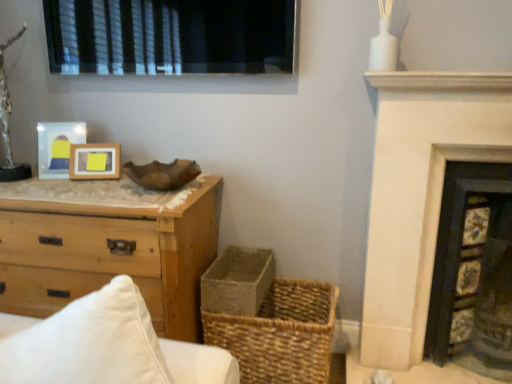
Question: Is wooden frame at center, the second picture frame viewed from the left, inside dark gray stone fireplace at right, marked as the 2th fireplace in a left-to-right arrangement?

Choices:
 (A) yes
 (B) no

Answer: (B)

Question: Could you tell me if dark gray stone fireplace at right, marked as the 2th fireplace in a left-to-right arrangement, is facing wooden frame at center, the second picture frame viewed from the left?

Choices:
 (A) yes
 (B) no

Answer: (B)

Question: Is dark gray stone fireplace at right, positioned as the first fireplace in right-to-left order, touching wooden frame at center, the second picture frame viewed from the left?

Choices:
 (A) no
 (B) yes

Answer: (A)

Question: Considering the relative sizes of dark gray stone fireplace at right, marked as the 2th fireplace in a left-to-right arrangement, and wooden frame at center, which appears as the first picture frame when viewed from the right, in the image provided, is dark gray stone fireplace at right, marked as the 2th fireplace in a left-to-right arrangement, bigger than wooden frame at center, which appears as the first picture frame when viewed from the right,?

Choices:
 (A) yes
 (B) no

Answer: (A)

Question: Is dark gray stone fireplace at right, positioned as the first fireplace in right-to-left order, at the right side of wooden frame at center, the second picture frame viewed from the left?

Choices:
 (A) no
 (B) yes

Answer: (B)

Question: From the image's perspective, is dark gray stone fireplace at right, marked as the 2th fireplace in a left-to-right arrangement, beneath wooden frame at center, the second picture frame viewed from the left?

Choices:
 (A) no
 (B) yes

Answer: (B)

Question: Considering the relative sizes of dark gray stone fireplace at right, positioned as the first fireplace in right-to-left order, and natural wood chest of drawers at left in the image provided, is dark gray stone fireplace at right, positioned as the first fireplace in right-to-left order, bigger than natural wood chest of drawers at left?

Choices:
 (A) yes
 (B) no

Answer: (B)

Question: Does dark gray stone fireplace at right, marked as the 2th fireplace in a left-to-right arrangement, lie behind natural wood chest of drawers at left?

Choices:
 (A) no
 (B) yes

Answer: (B)

Question: From a real-world perspective, is dark gray stone fireplace at right, positioned as the first fireplace in right-to-left order, physically above natural wood chest of drawers at left?

Choices:
 (A) yes
 (B) no

Answer: (A)

Question: From a real-world perspective, is dark gray stone fireplace at right, positioned as the first fireplace in right-to-left order, located beneath natural wood chest of drawers at left?

Choices:
 (A) no
 (B) yes

Answer: (A)

Question: Does dark gray stone fireplace at right, positioned as the first fireplace in right-to-left order, appear on the left side of natural wood chest of drawers at left?

Choices:
 (A) no
 (B) yes

Answer: (A)

Question: Is dark gray stone fireplace at right, marked as the 2th fireplace in a left-to-right arrangement, surrounding natural wood chest of drawers at left?

Choices:
 (A) yes
 (B) no

Answer: (B)

Question: Is white stone fireplace at upper right, the second fireplace viewed from the right, turned away from woven straw basket at lower center?

Choices:
 (A) no
 (B) yes

Answer: (A)